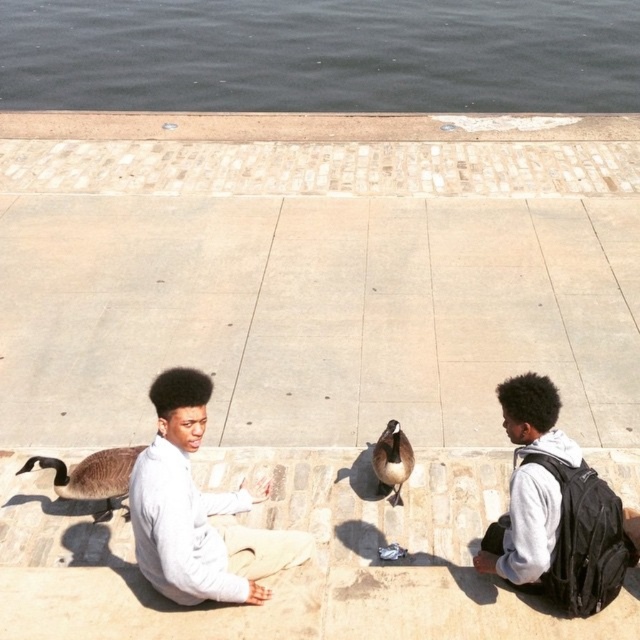
You are standing at point (557,51) and want to reach the water edge. The distance between you and the water edge is 16.13 meters. Can you walk directly to the water without crossing any obstacles?

The distance between you and the water edge is 16.13 meters. Since there are no obstacles mentioned in the scene description, you can walk directly to the water.

You are a photographer trying to capture the entire scene in one shot. Given that the dark gray water at upper center and the brown feathered duck at center are both in your frame, which object will occupy more horizontal space in the photo?

The dark gray water at upper center will occupy more horizontal space in the photo because its width is larger than that of the brown feathered duck at center.

You are a photographer trying to capture the brown feathered duck at center and the dark gray water at upper center in a single shot. Based on their positions, which object appears closer to the camera?

The brown feathered duck at center appears closer to the camera because it is much taller than the dark gray water at upper center, indicating it is positioned in front.